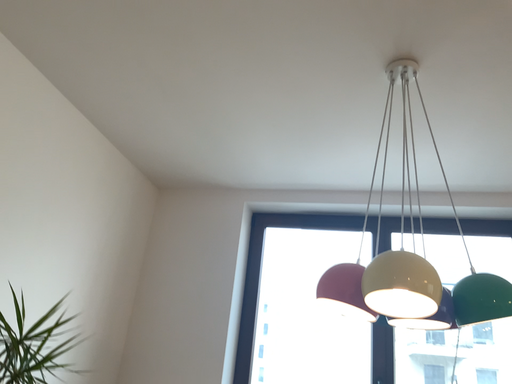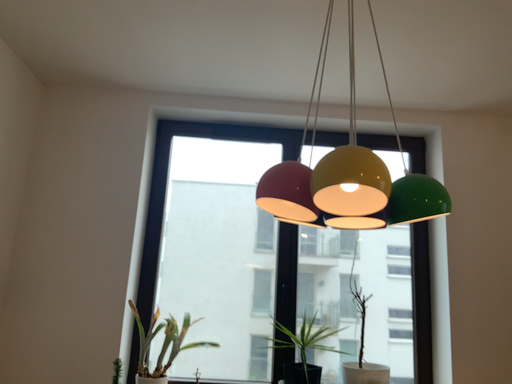
Question: How did the camera likely rotate when shooting the video?

Choices:
 (A) rotated downward
 (B) rotated upward

Answer: (A)